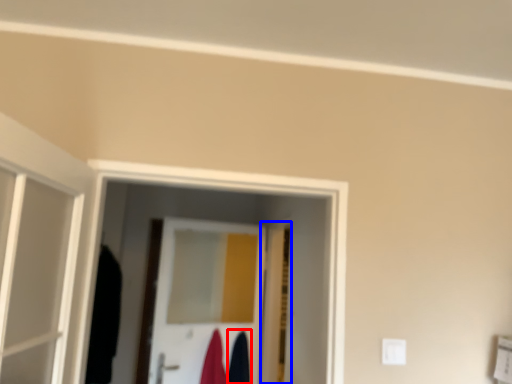
Question: Which point is closer to the camera, robe (highlighted by a red box) or door (highlighted by a blue box)?

Choices:
 (A) robe
 (B) door

Answer: (B)